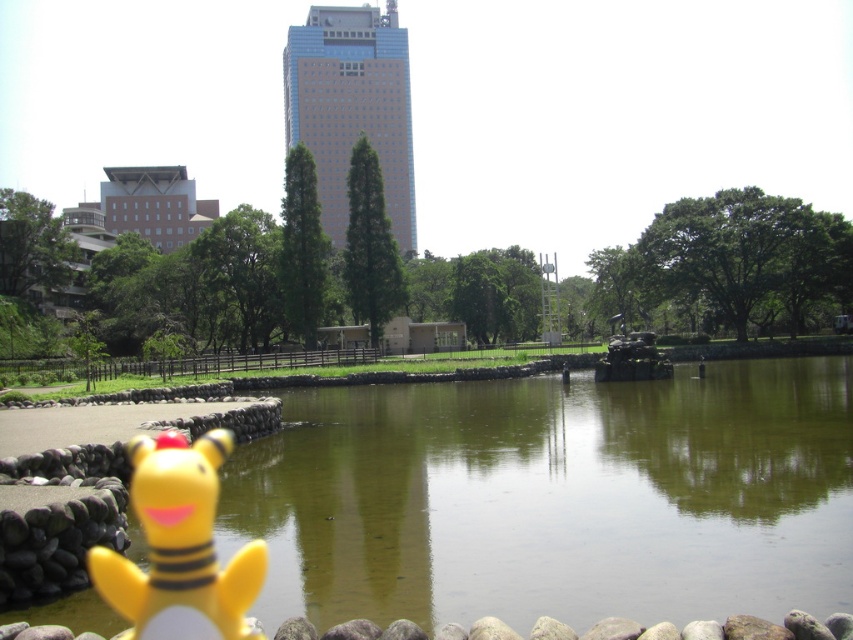
Which is more to the right, green smooth water at center or yellow matte plush toy at lower left?

green smooth water at center

Which is behind, point (525, 412) or point (154, 529)?

The point (525, 412) is more distant.

At what (x,y) coordinates should I click in order to perform the action: click on green smooth water at center. Please return your answer as a coordinate pair (x, y). This screenshot has width=853, height=640. Looking at the image, I should click on (555, 499).